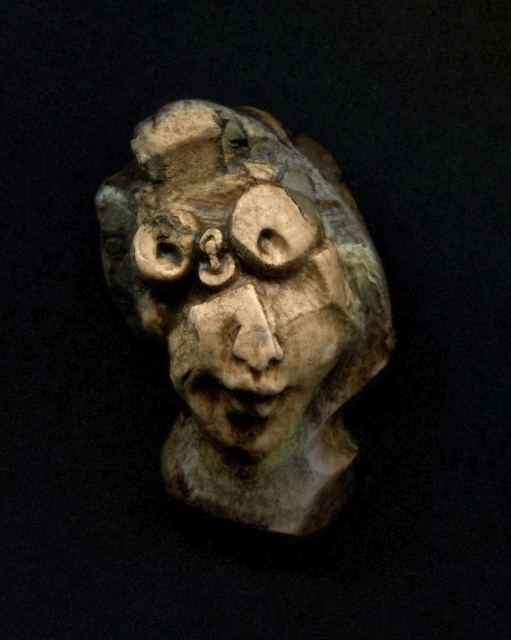
Can you confirm if matte stone sculpture at center is positioned to the left of carved stone face at center?

Incorrect, matte stone sculpture at center is not on the left side of carved stone face at center.

Can you confirm if matte stone sculpture at center is bigger than carved stone face at center?

Yes.

Which is behind, point (273, 145) or point (309, 280)?

The point (273, 145) is behind.

Where is `matte stone sculpture at center`? matte stone sculpture at center is located at coordinates (247, 307).